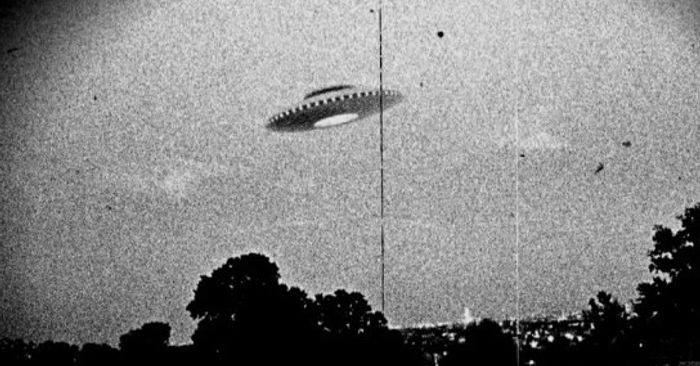
Identify the location of bottom light. The height and width of the screenshot is (366, 700). (335, 120).